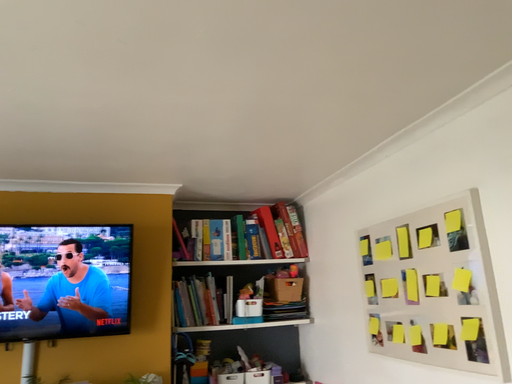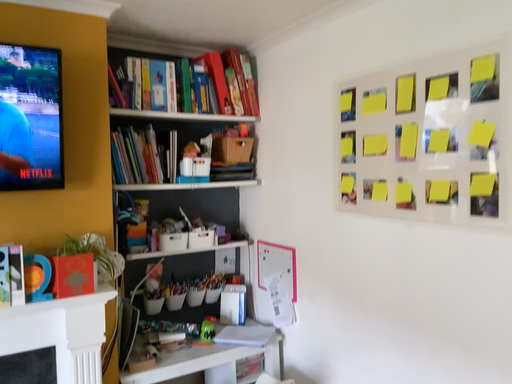
Question: Which way did the camera rotate in the video?

Choices:
 (A) rotated right
 (B) rotated left

Answer: (A)